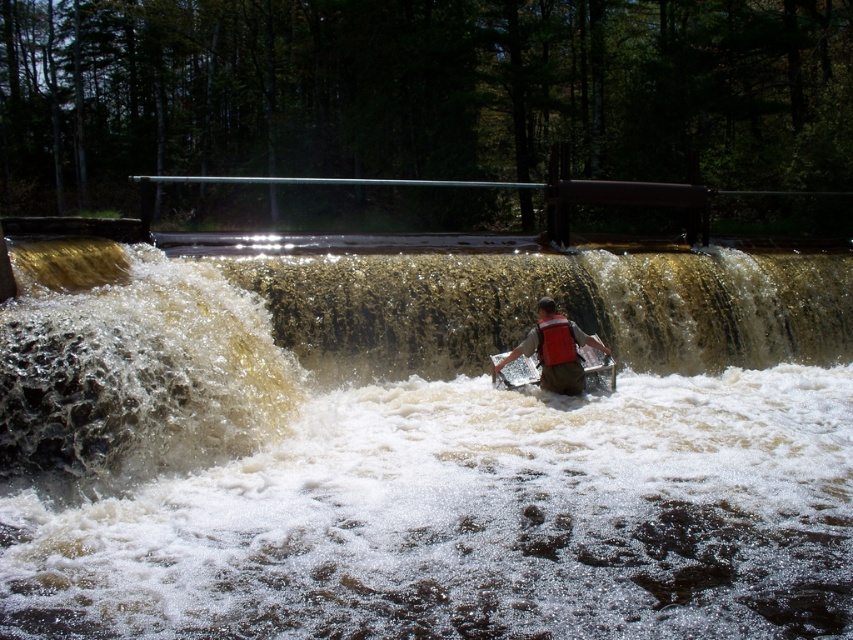
Question: Is brown textured water at center above orange life vest at center?

Choices:
 (A) yes
 (B) no

Answer: (A)

Question: Can you confirm if brown textured water at center is positioned to the right of orange life vest at center?

Choices:
 (A) yes
 (B) no

Answer: (B)

Question: Which point is farther to the camera?

Choices:
 (A) (752, 524)
 (B) (543, 321)

Answer: (B)

Question: Is brown textured water at center smaller than orange life vest at center?

Choices:
 (A) no
 (B) yes

Answer: (A)